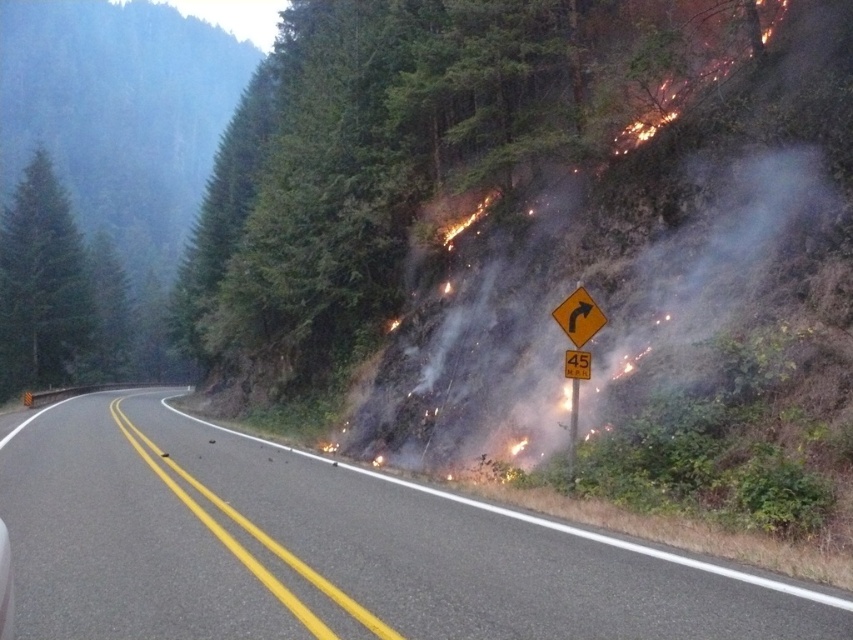
In order to click on black asphalt road at center in this screenshot , I will do `click(326, 548)`.

Is point (451, 525) in front of point (573, 358)?

That is True.

Image resolution: width=853 pixels, height=640 pixels. What are the coordinates of `black asphalt road at center` in the screenshot? It's located at (326, 548).

Does yellow plastic diamond-shaped sign at center-right appear under yellow plastic sign at center?

Yes, yellow plastic diamond-shaped sign at center-right is below yellow plastic sign at center.

Does point (573, 428) come behind point (585, 365)?

Yes.

The image size is (853, 640). Describe the element at coordinates (577, 352) in the screenshot. I see `yellow plastic diamond-shaped sign at center-right` at that location.

The image size is (853, 640). Identify the location of yellow plastic diamond-shaped sign at center-right. (577, 352).

Which is more to the right, smoketransparentatright or yellow reflective diamond-shaped at center?

From the viewer's perspective, smoketransparentatright appears more on the right side.

Can you confirm if smoketransparentatright is wider than yellow reflective diamond-shaped at center?

Indeed, smoketransparentatright has a greater width compared to yellow reflective diamond-shaped at center.

Where is `smoketransparentatright`? Image resolution: width=853 pixels, height=640 pixels. smoketransparentatright is located at coordinates (613, 298).